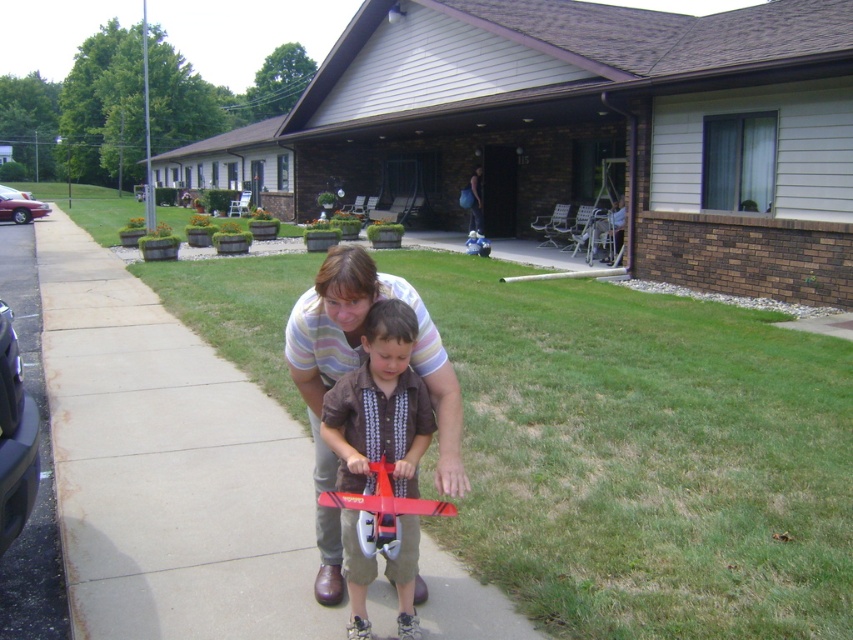
You are a photographer trying to capture a closeup of the matte brown shirt at center. Based on the coordinates provided in the scene description, where should you position your camera relative to the shirt?

The matte brown shirt at center is located at point coordinates (380, 404), so you should position your camera directly facing the shirt at that coordinate point to capture the closeup.

You are a delivery person trying to reach the front door of the residential building. You see the smooth concrete sidewalk at center and the metallic red toy car at left. Which object should you avoid stepping on to deliver the package safely?

You should avoid stepping on the metallic red toy car at left because the smooth concrete sidewalk at center is located below it, meaning the toy car is on top of the sidewalk and blocking the path.

You are a delivery person trying to place a package on the smooth concrete sidewalk at center and the metallic red toy car at left. Which surface is higher and more suitable for placing the package?

The smooth concrete sidewalk at center is much taller than the metallic red toy car at left, so it is more suitable for placing the package.